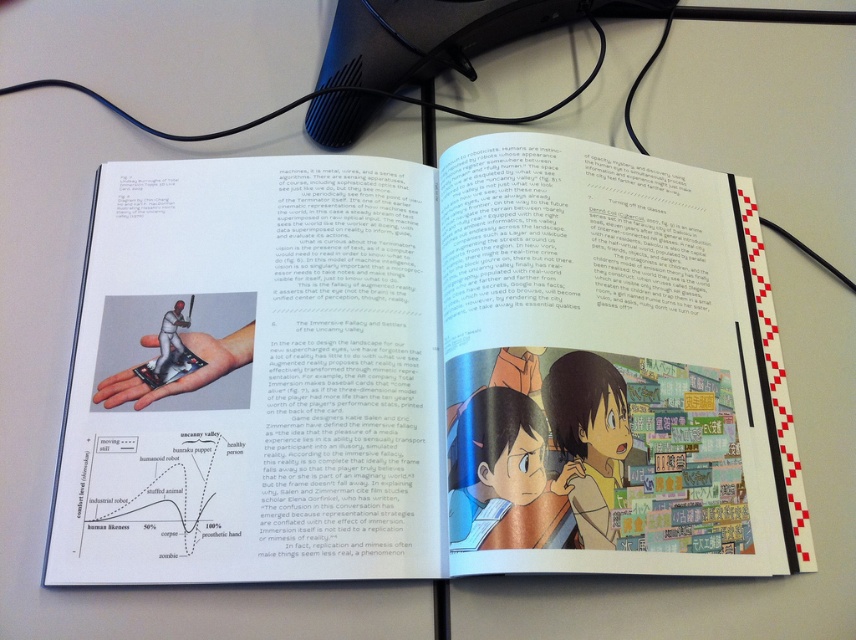
You are a photographer who needs to take a closeup shot of the matte paper book at center. Your camera is 23.59 inches away from the book. Is the distance sufficient for a clear photo?

The matte paper book at center and camera are 23.59 inches apart, so the distance is sufficient for a clear photo as most cameras can focus at that distance.

Based on the photo, you are trying to place the smooth skin hand at center on top of the matte paper book at center. Can the hand fit entirely on the book without hanging off the edges?

The matte paper book at center might be wider than smooth skin hand at center, so there is a possibility that the hand can fit, but the exact dimensions are uncertain.

You are an artist trying to place a matte paper book at center and a smooth skin hand at center on a shelf. If the shelf has only enough space for one of them, which item should you choose to fit based on their sizes?

The matte paper book at center is bigger than the smooth skin hand at center, so the smooth skin hand at center would fit on the shelf.